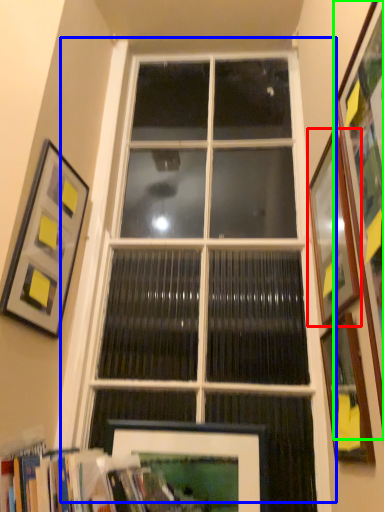
Question: Estimate the real-world distances between objects in this image. Which object is farther from picture frame (highlighted by a red box), window (highlighted by a blue box) or picture frame (highlighted by a green box)?

Choices:
 (A) window
 (B) picture frame

Answer: (A)